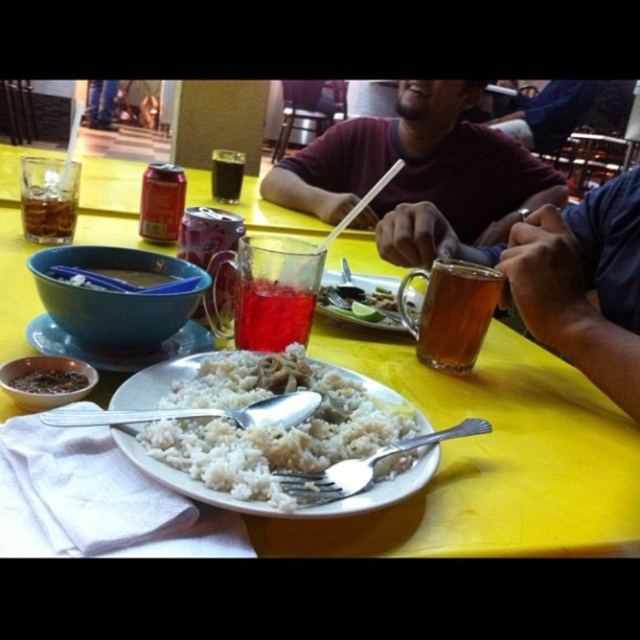
You are a server at the restaurant and need to place a new plate on the table. The current plate is on the yellow plastic table at center. Where should you place the new plate so it doesn not block the brown crumbly food at center?

The yellow plastic table at center is in front of the brown crumbly food at center, so placing the new plate behind the existing plate would keep it from blocking the brown crumbly food at center.